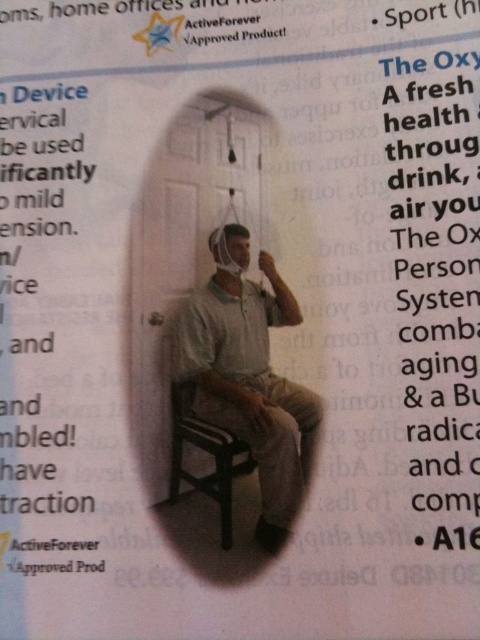
Question: Can you confirm if matte white shirt at center is wider than wooden chair at lower center?

Choices:
 (A) yes
 (B) no

Answer: (A)

Question: Is matte white shirt at center positioned before wooden chair at lower center?

Choices:
 (A) yes
 (B) no

Answer: (A)

Question: Which of the following is the farthest from the observer?

Choices:
 (A) (287, 406)
 (B) (225, 452)

Answer: (A)

Question: Which point appears closest to the camera in this image?

Choices:
 (A) (235, 429)
 (B) (208, 476)

Answer: (B)

Question: Can you confirm if matte white shirt at center is thinner than wooden chair at lower center?

Choices:
 (A) no
 (B) yes

Answer: (A)